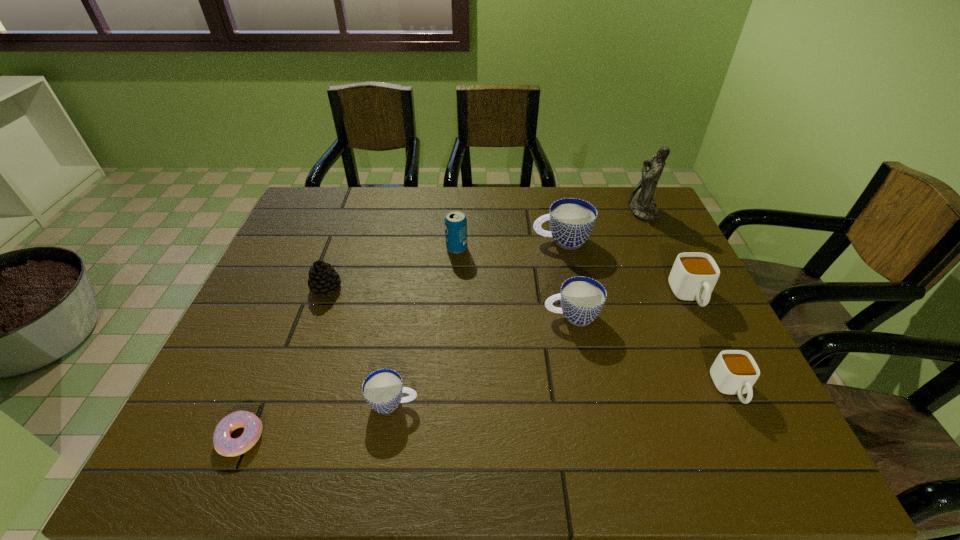
At what (x,y) coordinates should I click in order to perform the action: click on free area in between the pink doughnut and the smaller white cup. Please return your answer as a coordinate pair (x, y). The image size is (960, 540). Looking at the image, I should click on (486, 414).

I want to click on free spot between the nearer white cup and the bigger white cup, so click(710, 343).

Choose which object is the seventh nearest neighbor to the farthest object. Please provide its 2D coordinates. Your answer should be formatted as a tuple, i.e. [(x, y)], where the tuple contains the x and y coordinates of a point satisfying the conditions above.

[(323, 278)]

Point out which object is positioned as the sixth nearest to the nearer white cup. Please provide its 2D coordinates. Your answer should be formatted as a tuple, i.e. [(x, y)], where the tuple contains the x and y coordinates of a point satisfying the conditions above.

[(455, 221)]

Image resolution: width=960 pixels, height=540 pixels. I want to click on the fourth closest cup to the farther white cup, so click(383, 389).

Locate which cup is the second closest to the nearest blue cup. Please provide its 2D coordinates. Your answer should be formatted as a tuple, i.e. [(x, y)], where the tuple contains the x and y coordinates of a point satisfying the conditions above.

[(572, 220)]

Identify which blue cup is the nearest to the smaller white cup. Please provide its 2D coordinates. Your answer should be formatted as a tuple, i.e. [(x, y)], where the tuple contains the x and y coordinates of a point satisfying the conditions above.

[(582, 298)]

Locate an element on the screen. This screenshot has height=540, width=960. blue cup that is the closest to the biggest blue cup is located at coordinates (582, 298).